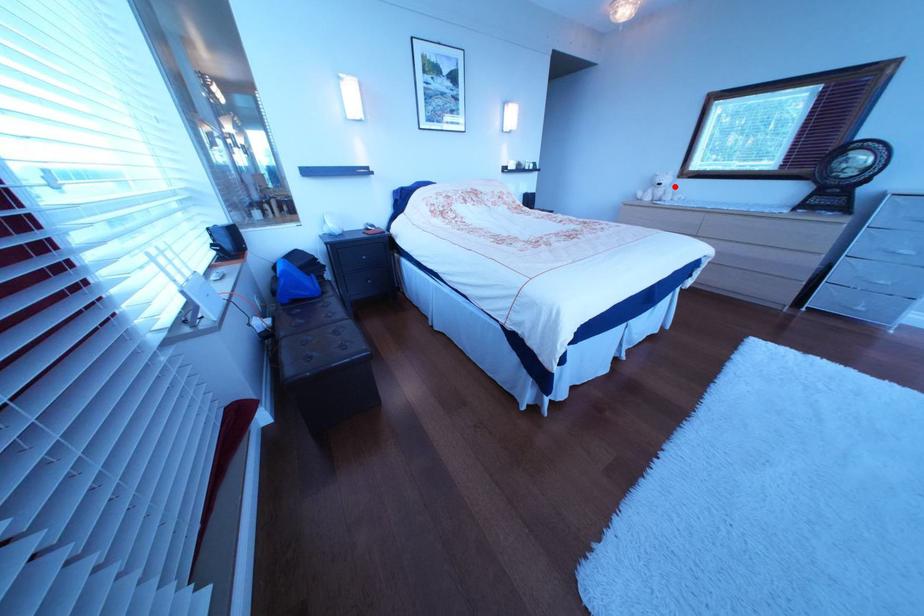
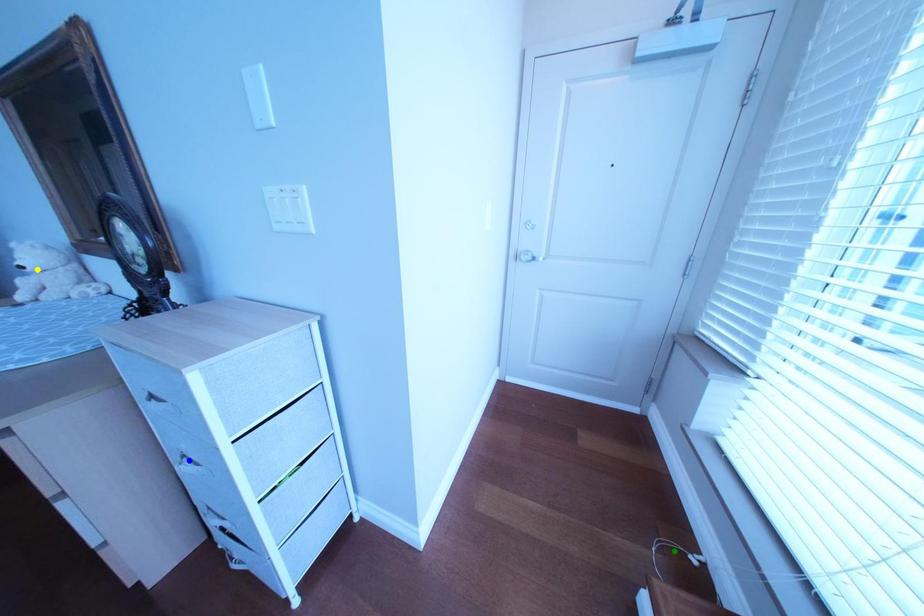
Question: I am providing you with two images of the same scene from different viewpoints. A red point is marked on the first image. You are given multiple points on the second image. Which mark in image 2 goes with the point in image 1?

Choices:
 (A) green point
 (B) blue point
 (C) yellow point

Answer: (C)